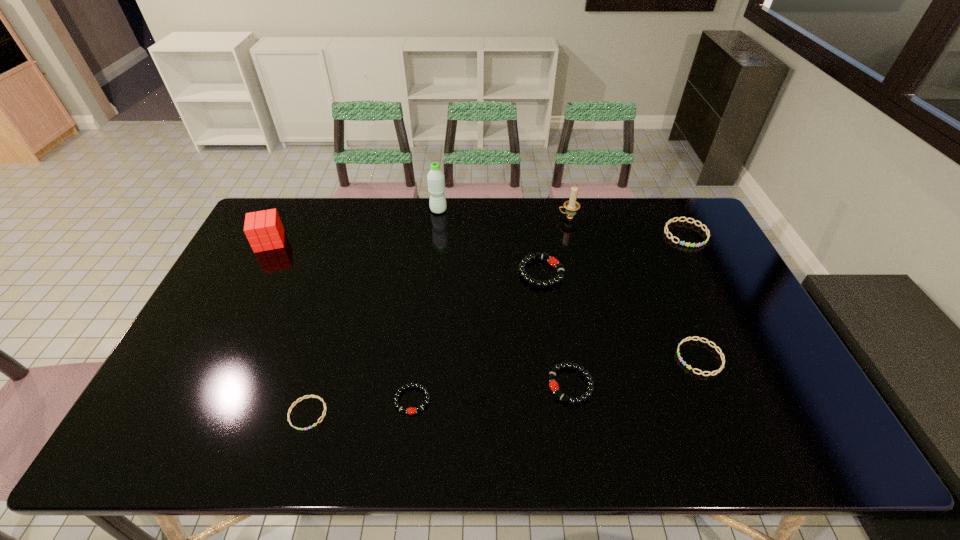
Where is `free area in between the second farthest blue bracelet and the leftmost black bracelet`? Image resolution: width=960 pixels, height=540 pixels. free area in between the second farthest blue bracelet and the leftmost black bracelet is located at coordinates (556, 379).

Locate an element on the screen. The image size is (960, 540). free space that is in between the cube and the farthest black bracelet is located at coordinates (405, 257).

The image size is (960, 540). I want to click on object identified as the sixth closest to the candle_holder, so click(x=411, y=410).

Locate an element on the screen. The height and width of the screenshot is (540, 960). object that stands as the sixth closest to the second smallest blue bracelet is located at coordinates (436, 179).

Find the location of a particular element. bracelet that is the fourth closest to the second smallest black bracelet is located at coordinates (309, 396).

You are a GUI agent. You are given a task and a screenshot of the screen. Output one action in this format:
    pyautogui.click(x=<x>, y=<y>)
    Task: Click on the bracelet that is the third closest to the smallest blue bracelet
    This screenshot has width=960, height=540.
    Given the screenshot: What is the action you would take?
    pyautogui.click(x=552, y=261)

Point out which black bracelet is positioned as the second nearest to the farthest black bracelet. Please provide its 2D coordinates. Your answer should be formatted as a tuple, i.e. [(x, y)], where the tuple contains the x and y coordinates of a point satisfying the conditions above.

[(411, 410)]

You are a GUI agent. You are given a task and a screenshot of the screen. Output one action in this format:
    pyautogui.click(x=<x>, y=<y>)
    Task: Click on the black bracelet that is the second closest one to the farthest bracelet
    The height and width of the screenshot is (540, 960).
    Given the screenshot: What is the action you would take?
    pos(553,384)

Locate an element on the screen. the closest blue bracelet to the candle_holder is located at coordinates (672, 237).

Where is `blue bracelet identified as the closest to the leftmost object`? blue bracelet identified as the closest to the leftmost object is located at coordinates (309, 396).